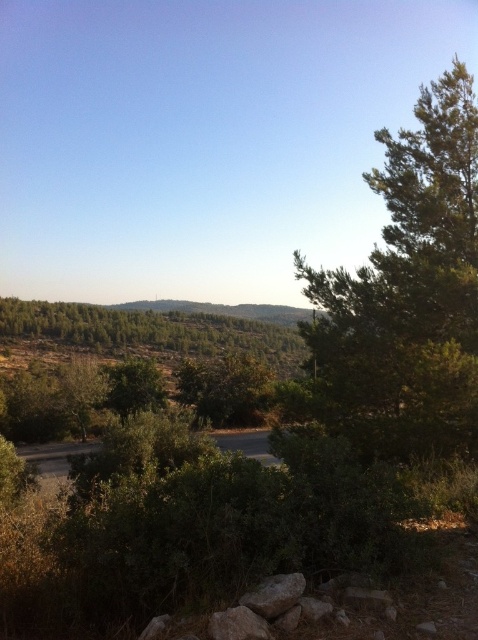
Describe the element at coordinates (409, 292) in the screenshot. The image size is (478, 640). I see `green leafy tree at right` at that location.

Does point (406, 243) come in front of point (283, 314)?

Yes, point (406, 243) is in front of point (283, 314).

This screenshot has height=640, width=478. What do you see at coordinates (409, 292) in the screenshot?
I see `green leafy tree at right` at bounding box center [409, 292].

Where is `green leafy tree at right`? The width and height of the screenshot is (478, 640). green leafy tree at right is located at coordinates (409, 292).

Does green textured hillside at center lie behind green textured hill at center?

Yes, green textured hillside at center is further from the viewer.

Is point (296, 360) more distant than point (289, 310)?

No.

Between point (67, 323) and point (164, 301), which one is positioned behind?

The point (164, 301) is behind.

Locate an element on the screen. This screenshot has width=478, height=640. green textured hillside at center is located at coordinates (149, 330).

Between point (347, 275) and point (110, 348), which one is positioned behind?

The point (110, 348) is behind.

Can you confirm if green leafy tree at right is positioned below green textured hillside at center?

No, green leafy tree at right is not below green textured hillside at center.

Does point (446, 86) lie in front of point (164, 330)?

Yes, point (446, 86) is closer to viewer.

You are a GUI agent. You are given a task and a screenshot of the screen. Output one action in this format:
    pyautogui.click(x=<x>, y=<y>)
    Task: Click on the green leafy tree at right
    Image resolution: width=478 pixels, height=640 pixels.
    Given the screenshot: What is the action you would take?
    pyautogui.click(x=409, y=292)